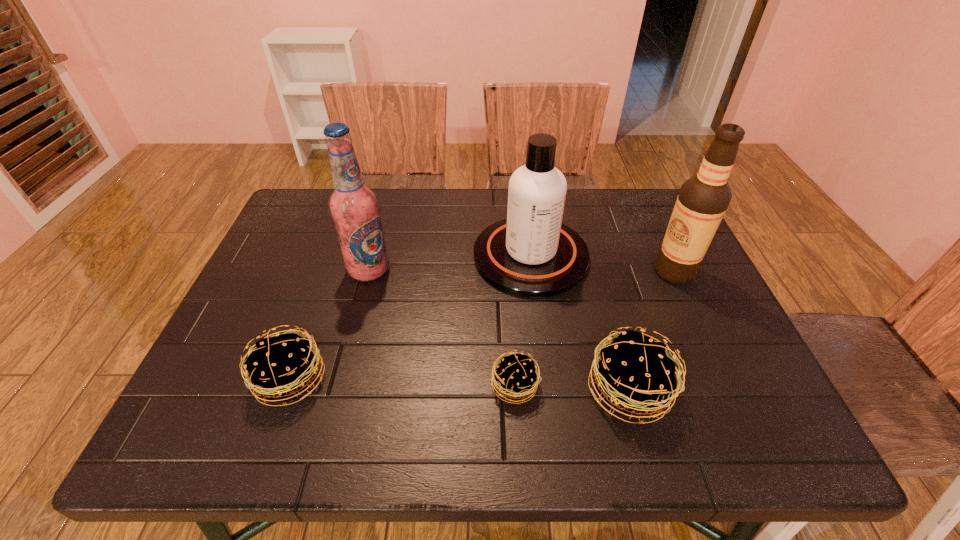
Image resolution: width=960 pixels, height=540 pixels. Find the location of `the second shortest patty`. the second shortest patty is located at coordinates (281, 368).

Find the location of a particular element. the leftmost patty is located at coordinates (281, 368).

You are a GUI agent. You are given a task and a screenshot of the screen. Output one action in this format:
    pyautogui.click(x=<x>, y=<y>)
    Task: Click on the shortest patty
    
    Given the screenshot: What is the action you would take?
    pyautogui.click(x=522, y=384)

What are the coordinates of `the shortest object` in the screenshot? It's located at (522, 384).

This screenshot has width=960, height=540. What are the coordinates of `the rightmost patty` in the screenshot? It's located at (635, 375).

The height and width of the screenshot is (540, 960). Identify the location of the fourth shortest object. (532, 254).

Where is `the left alcohol`? The height and width of the screenshot is (540, 960). the left alcohol is located at coordinates (354, 208).

You are a GUI agent. You are given a task and a screenshot of the screen. Output one action in this format:
    pyautogui.click(x=<x>, y=<y>)
    Task: Click on the rightmost object
    
    Given the screenshot: What is the action you would take?
    pyautogui.click(x=703, y=199)

At what (x,y) coordinates should I click in order to perform the action: click on vacant space located on the back of the second tallest patty. Please return your answer as a coordinate pair (x, y). The width and height of the screenshot is (960, 540). Looking at the image, I should click on (338, 246).

The image size is (960, 540). In order to click on blank space located 0.130m on the back of the shortest patty in this screenshot , I will do `click(511, 319)`.